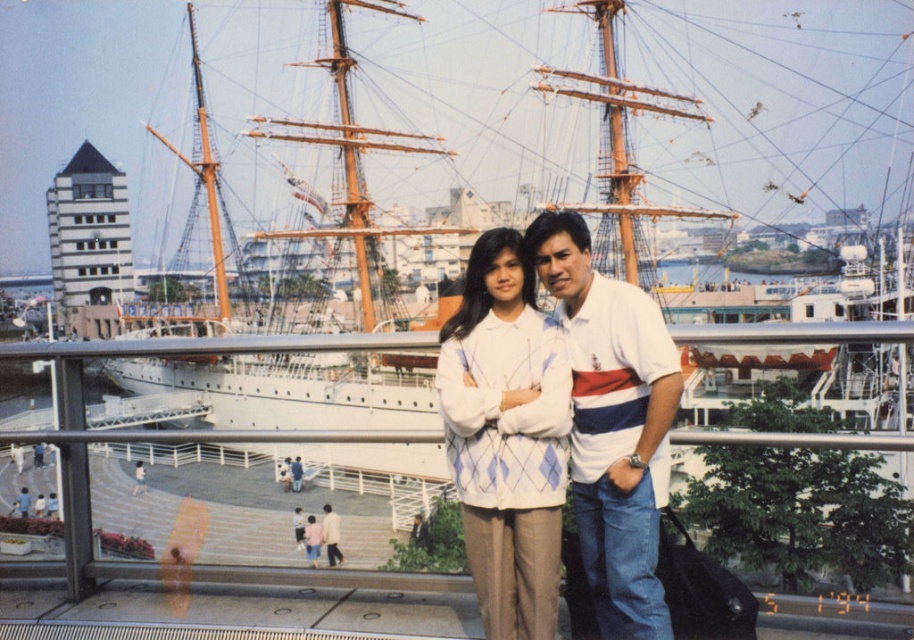
You are taking a photo of two people wearing the white knitwear at center and the light brown leather jacket at center. Which clothing item is closer to the camera?

The white knitwear at center is closer to the camera because it is in front of the light brown leather jacket at center.

You are standing at the point labeled point (x=624, y=428) and want to move to the point labeled point (x=337, y=534). Which direction should you move to get closer to your destination?

You should move downward and to the right because point (x=337, y=534) is located below and to the right of point (x=624, y=428).

You are a photographer trying to capture the two people in the foreground of the marina scene. You notice the white knitwear at center and the light brown leather jacket at center. Which clothing item is covering part of the other?

The white knitwear at center is positioned over the light brown leather jacket at center, so it is covering part of it.